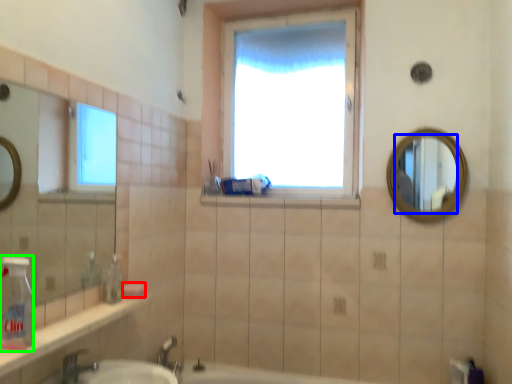
Question: Which object is positioned farthest from soap (highlighted by a red box)? Select from mirror (highlighted by a blue box) and bottle (highlighted by a green box).

Choices:
 (A) mirror
 (B) bottle

Answer: (A)